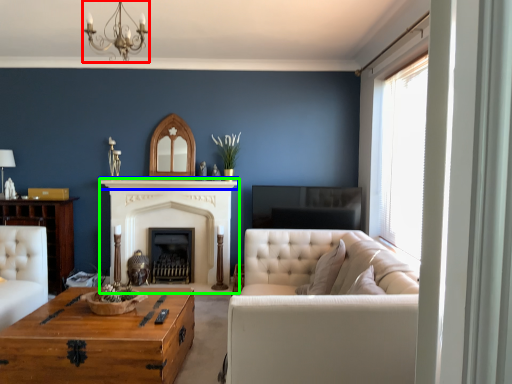
Question: Considering the real-world distances, which object is farthest from light fixture (highlighted by a red box)? mantle (highlighted by a blue box) or fireplace (highlighted by a green box)?

Choices:
 (A) mantle
 (B) fireplace

Answer: (B)